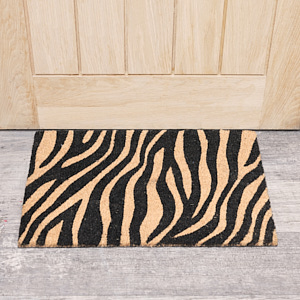
I want to click on door, so [168, 84].